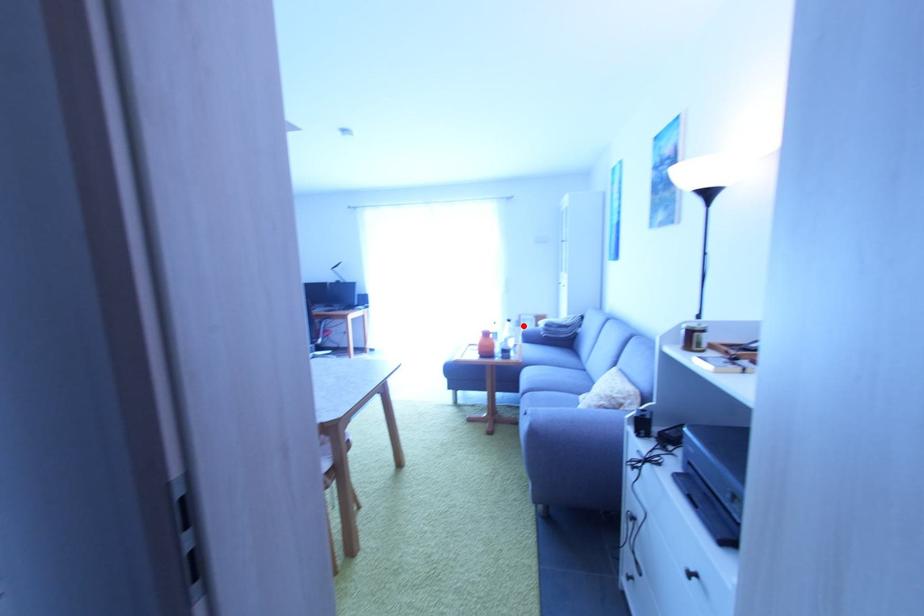
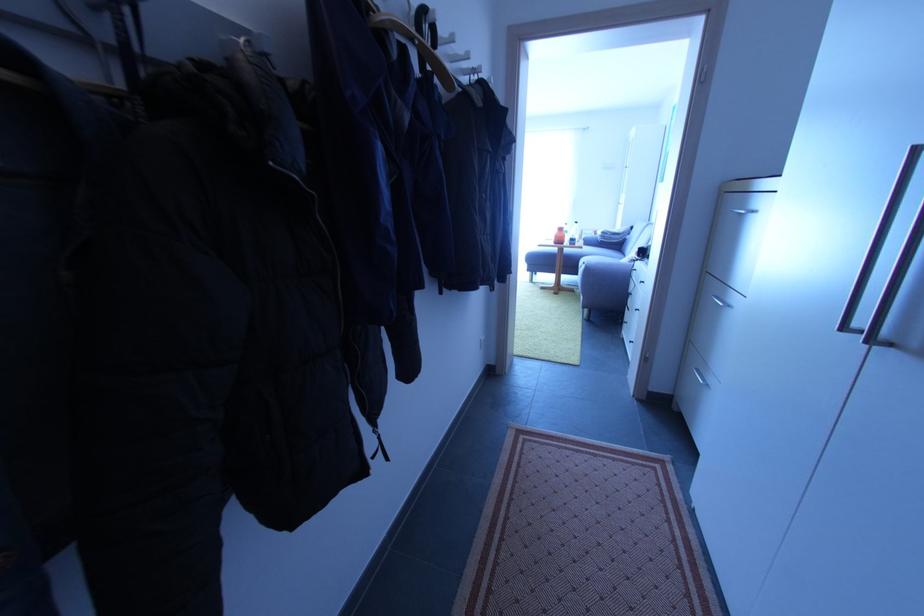
Where in the second image is the point corresponding to the highlighted location from the first image?

(585, 238)